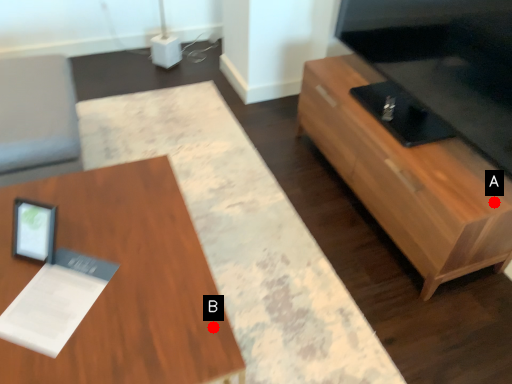
Question: Two points are circled on the image, labeled by A and B beside each circle. Which point is farther from the camera taking this photo?

Choices:
 (A) A is further
 (B) B is further

Answer: (A)